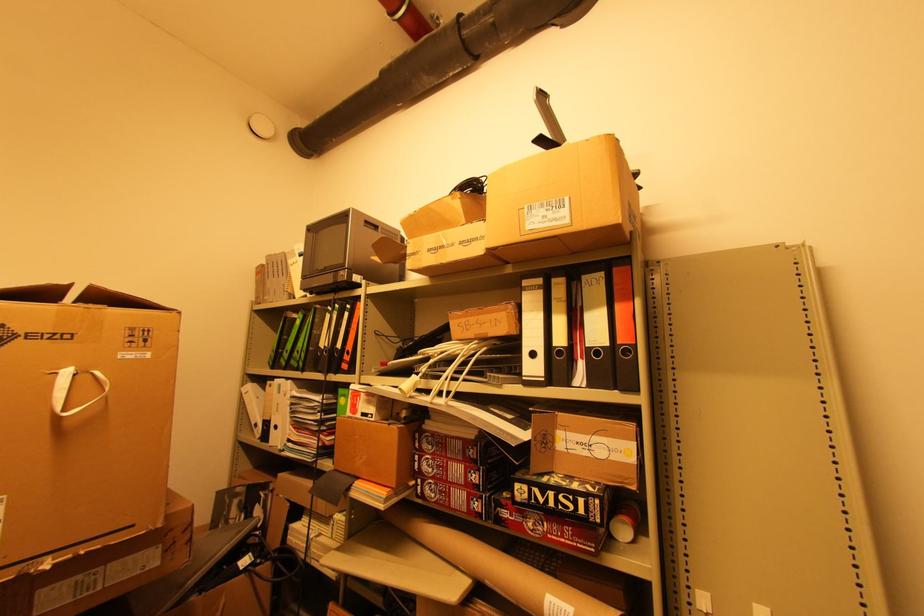
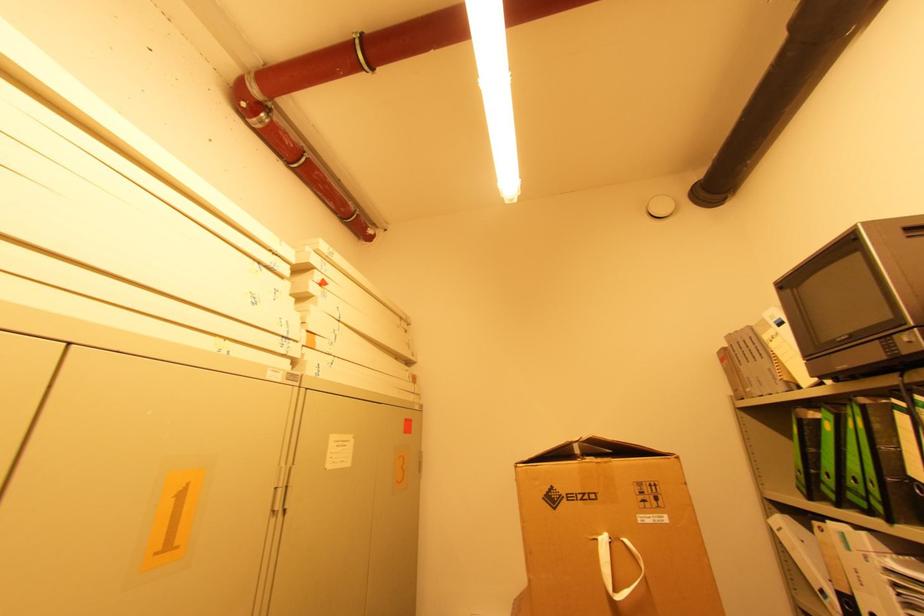
The point at (286, 353) is marked in the first image. Where is the corresponding point in the second image?

(822, 476)